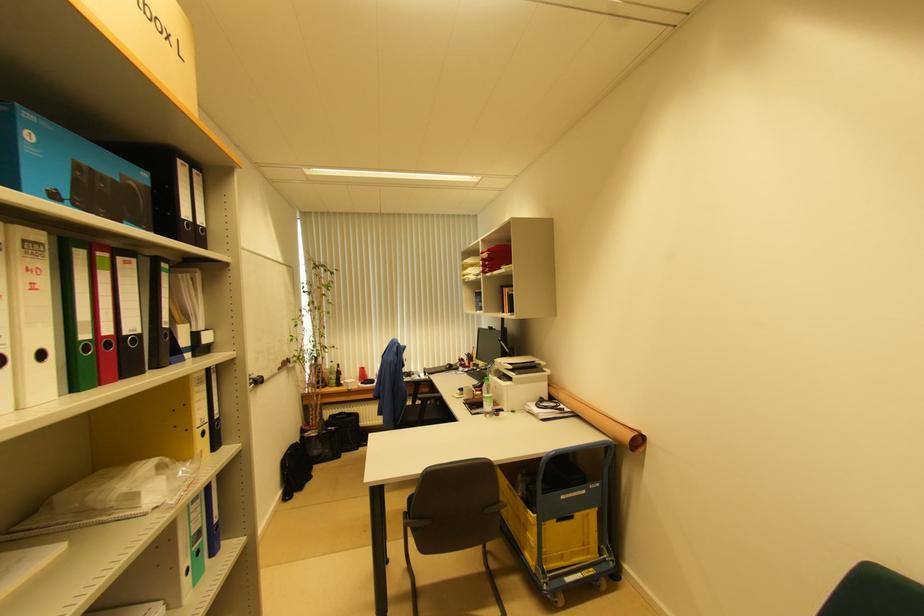
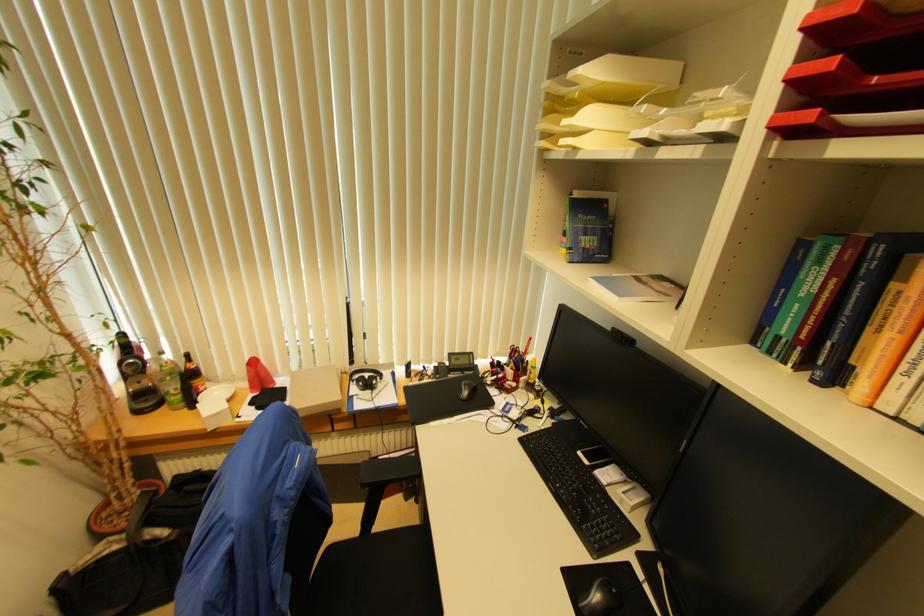
Find the pixel in the second image that matches [448,369] in the first image.

(467, 395)